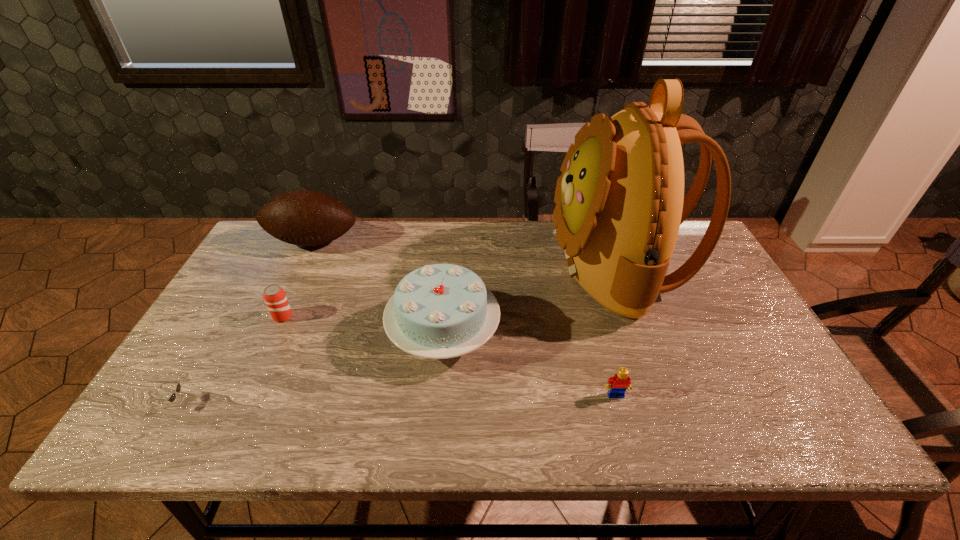
Where is `free location that satisfies the following two spatial constraints: 1. on the front-facing side of the Lego; 2. in front of the lenses of the sunglasses`? free location that satisfies the following two spatial constraints: 1. on the front-facing side of the Lego; 2. in front of the lenses of the sunglasses is located at coordinates (618, 403).